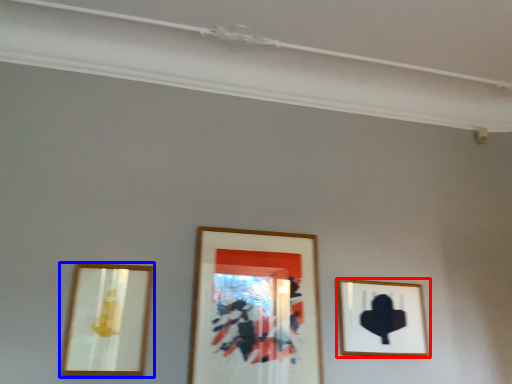
Question: Among these objects, which one is farthest to the camera, picture frame (highlighted by a red box) or picture frame (highlighted by a blue box)?

Choices:
 (A) picture frame
 (B) picture frame

Answer: (A)